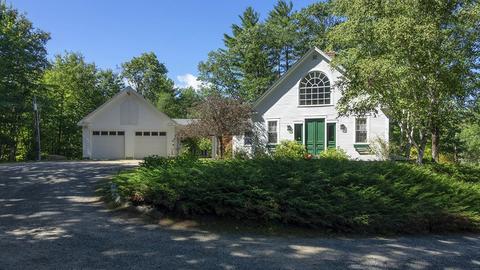
This screenshot has width=480, height=270. I want to click on double door, so click(x=316, y=140).